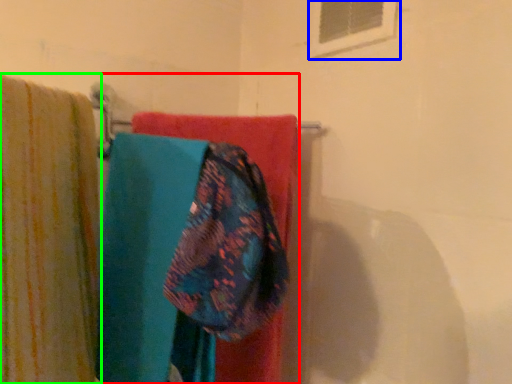
Question: Which object is positioned farthest from laundry (highlighted by a red box)? Select from window (highlighted by a blue box) and curtain (highlighted by a green box).

Choices:
 (A) window
 (B) curtain

Answer: (A)